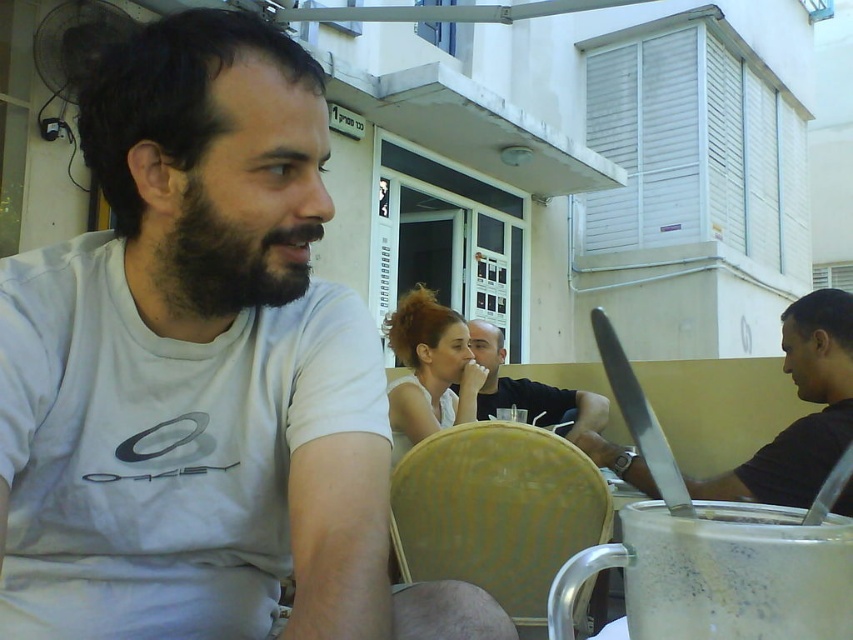
You are a photographer trying to capture a candid shot of the matte white blouse at center without the silver metallic laptop at right blocking the view. Is the laptop likely to obstruct your photo? Explain why.

The silver metallic laptop at right has a greater height compared to the matte white blouse at center, so the laptop is taller and could potentially block the view of the blouse depending on the angle and distance. However, since the blouse is at the center and the laptop is at the right, adjusting the camera angle might allow you to avoid obstruction.